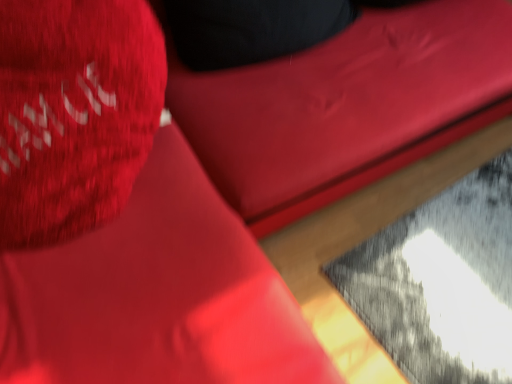
Question: From a real-world perspective, is matte red throw pillow at upper left positioned above or below velvet-like red bean bag chair at upper center?

Choices:
 (A) above
 (B) below

Answer: (A)

Question: Is point (118, 190) closer or farther from the camera than point (236, 173)?

Choices:
 (A) closer
 (B) farther

Answer: (A)

Question: Considering their positions, is matte red throw pillow at upper left located in front of or behind velvet-like red bean bag chair at upper center?

Choices:
 (A) behind
 (B) front

Answer: (B)

Question: Is point (396, 39) positioned closer to the camera than point (138, 142)?

Choices:
 (A) closer
 (B) farther

Answer: (B)

Question: Is velvet-like red bean bag chair at upper center to the left or to the right of matte red throw pillow at upper left in the image?

Choices:
 (A) right
 (B) left

Answer: (A)

Question: Is velvet-like red bean bag chair at upper center bigger or smaller than matte red throw pillow at upper left?

Choices:
 (A) big
 (B) small

Answer: (A)

Question: From the image's perspective, is velvet-like red bean bag chair at upper center above or below matte red throw pillow at upper left?

Choices:
 (A) above
 (B) below

Answer: (A)